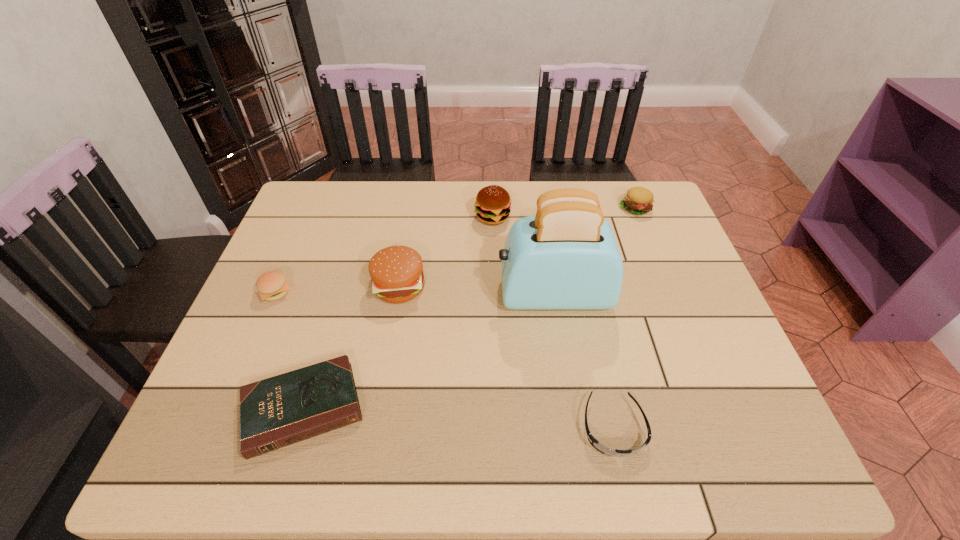
Find the location of a particular element. The image size is (960, 540). free spot located 0.130m on the back of the second hamburger from right to left is located at coordinates (492, 182).

Locate an element on the screen. The image size is (960, 540). free space located on the right of the second hamburger from left to right is located at coordinates (577, 286).

You are a GUI agent. You are given a task and a screenshot of the screen. Output one action in this format:
    pyautogui.click(x=<x>, y=<y>)
    Task: Click on the vacant region located 0.120m on the left of the rightmost hamburger
    The height and width of the screenshot is (540, 960).
    Given the screenshot: What is the action you would take?
    pyautogui.click(x=580, y=208)

Find the location of a particular element. This screenshot has height=540, width=960. vacant area situated 0.230m on the front of the leftmost hamburger is located at coordinates (233, 390).

This screenshot has height=540, width=960. Identify the location of free space located on the right of the Bible. (488, 408).

Identify the location of sunglasses present at the near edge. (594, 442).

This screenshot has width=960, height=540. Identify the location of Bible that is positioned at the near edge. (288, 408).

Locate an element on the screen. hamburger that is at the left edge is located at coordinates (272, 285).

You are a GUI agent. You are given a task and a screenshot of the screen. Output one action in this format:
    pyautogui.click(x=<x>, y=<y>)
    Task: Click on the Bible present at the left edge
    This screenshot has height=540, width=960.
    Given the screenshot: What is the action you would take?
    pyautogui.click(x=288, y=408)

At what (x,y) coordinates should I click in order to perform the action: click on object positioned at the right edge. Please return your answer as a coordinate pair (x, y). Looking at the image, I should click on (639, 200).